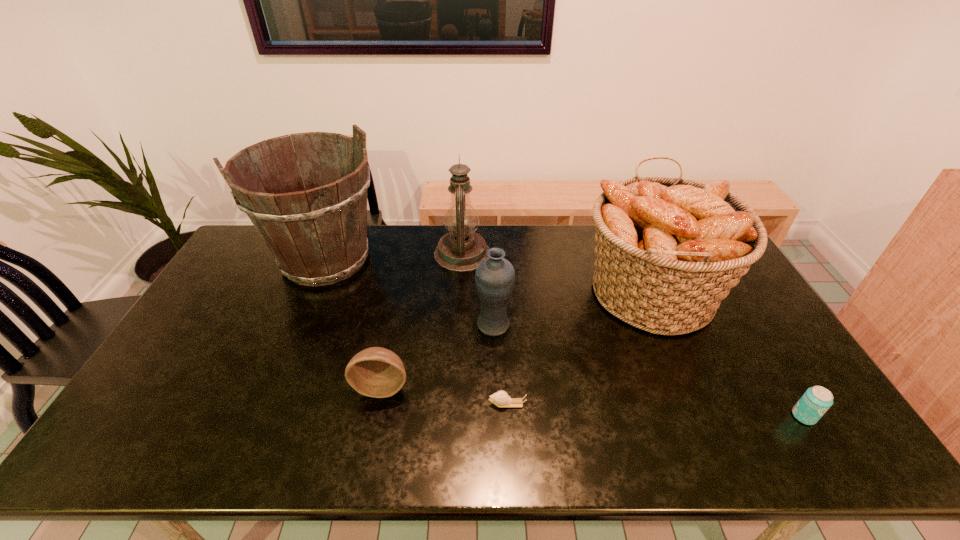
Locate an element on the screen. The width and height of the screenshot is (960, 540). the leftmost object is located at coordinates (318, 236).

This screenshot has height=540, width=960. What are the coordinates of `oil lamp` in the screenshot? It's located at (461, 250).

Locate an element on the screen. basket is located at coordinates (668, 250).

Find the location of a particular element. vase is located at coordinates (495, 276).

Where is `the third shortest object`? The image size is (960, 540). the third shortest object is located at coordinates (377, 372).

Where is `bowl`? The width and height of the screenshot is (960, 540). bowl is located at coordinates (377, 372).

You are a GUI agent. You are given a task and a screenshot of the screen. Output one action in this format:
    pyautogui.click(x=<x>, y=<y>)
    Task: Click on the beer can
    
    Given the screenshot: What is the action you would take?
    pyautogui.click(x=814, y=403)

What are the coordinates of `the shortest object` in the screenshot? It's located at (501, 399).

Locate an element on the screen. vacant space located on the right of the leftmost object is located at coordinates (436, 260).

Locate an element on the screen. Image resolution: width=960 pixels, height=540 pixels. free location located on the right of the oil lamp is located at coordinates (602, 254).